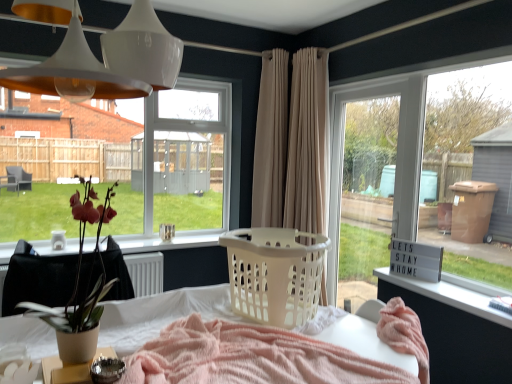
What is the approximate width of beige fabric curtain at center, which is counted as the first curtain, starting from the right?

The width of beige fabric curtain at center, which is counted as the first curtain, starting from the right, is 16.81 inches.

The height and width of the screenshot is (384, 512). Identify the location of matte brown pot at left. (85, 283).

Locate an element on the screen. The height and width of the screenshot is (384, 512). white plastic door at center is located at coordinates (396, 158).

Describe the element at coordinates (455, 329) in the screenshot. The height and width of the screenshot is (384, 512). I see `white plastic changing table at lower right` at that location.

Identify the location of beige fabric curtain at center, which is counted as the first curtain, starting from the right. (292, 143).

What's the angular difference between matte brown pot at left and beige fabric curtain at center, placed as the 1th curtain when sorted from left to right,'s facing directions?

The angle between the facing direction of matte brown pot at left and the facing direction of beige fabric curtain at center, placed as the 1th curtain when sorted from left to right, is 0.08 degrees.

Considering the sizes of matte brown pot at left and beige fabric curtain at center, the 2th curtain when ordered from right to left, in the image, is matte brown pot at left wider or thinner than beige fabric curtain at center, the 2th curtain when ordered from right to left,?

Clearly, matte brown pot at left has less width compared to beige fabric curtain at center, the 2th curtain when ordered from right to left.

Based on their sizes in the image, would you say matte brown pot at left is bigger or smaller than beige fabric curtain at center, the 2th curtain when ordered from right to left?

matte brown pot at left is smaller than beige fabric curtain at center, the 2th curtain when ordered from right to left.

Is matte brown pot at left further to camera compared to beige fabric curtain at center, placed as the 1th curtain when sorted from left to right?

That is False.

Image resolution: width=512 pixels, height=384 pixels. Identify the location of curtain below the clear glass window at upper left (from the image's perspective). (292, 143).

Does beige fabric curtain at center, the 2th curtain from the left, turn towards clear glass window at upper left?

No, beige fabric curtain at center, the 2th curtain from the left, is not facing towards clear glass window at upper left.

Which object is wider, beige fabric curtain at center, which is counted as the first curtain, starting from the right, or clear glass window at upper left?

With larger width is beige fabric curtain at center, which is counted as the first curtain, starting from the right.

Do you think beige fabric curtain at center, the 2th curtain from the left, is within clear glass window at upper left, or outside of it?

beige fabric curtain at center, the 2th curtain from the left, is spatially situated outside clear glass window at upper left.

Considering the relative sizes of beige fabric curtain at center, which is counted as the first curtain, starting from the right, and white plastic table at lower center in the image provided, is beige fabric curtain at center, which is counted as the first curtain, starting from the right, bigger than white plastic table at lower center?

No, beige fabric curtain at center, which is counted as the first curtain, starting from the right, is not bigger than white plastic table at lower center.

Consider the image. From a real-world perspective, which object rests below the other?

white plastic table at lower center is physically lower.

How much distance is there between beige fabric curtain at center, the 2th curtain from the left, and white plastic table at lower center?

A distance of 1.47 meters exists between beige fabric curtain at center, the 2th curtain from the left, and white plastic table at lower center.

Looking at this image, from the image's perspective, is beige fabric curtain at center, which is counted as the first curtain, starting from the right, located above or below white plastic table at lower center?

Based on their image positions, beige fabric curtain at center, which is counted as the first curtain, starting from the right, is located above white plastic table at lower center.

Based on the photo, visually, is white plastic door at center positioned to the left or to the right of white plastic laundry basket at center?

white plastic door at center is positioned on white plastic laundry basket at center's right side.

From the image's perspective, between white plastic door at center and white plastic laundry basket at center, which one is located above?

white plastic door at center, from the image's perspective.

In the scene shown: Could you tell me if white plastic door at center is facing white plastic laundry basket at center?

→ No, white plastic door at center is not oriented towards white plastic laundry basket at center.

The image size is (512, 384). Identify the location of window frame above the white plastic laundry basket at center (from a real-world perspective). (396, 158).

At what (x,y) coordinates should I click in order to perform the action: click on window beneath the beige fabric curtain at center, placed as the 1th curtain when sorted from left to right (from a real-world perspective). Please return your answer as a coordinate pair (x, y). Looking at the image, I should click on (143, 161).

Is clear glass window at upper left inside beige fabric curtain at center, the 2th curtain when ordered from right to left?

No.

Is beige fabric curtain at center, placed as the 1th curtain when sorted from left to right, far from clear glass window at upper left?

Indeed, beige fabric curtain at center, placed as the 1th curtain when sorted from left to right, is not near clear glass window at upper left.

Is beige fabric curtain at center, the 2th curtain when ordered from right to left, at the right side of clear glass window at upper left?

Yes.

Consider the image. From a real-world perspective, is white plastic table at lower center positioned under beige fabric curtain at center, the 2th curtain from the left, based on gravity?

Indeed, from a real-world perspective, white plastic table at lower center is positioned beneath beige fabric curtain at center, the 2th curtain from the left.

Considering the sizes of objects white plastic table at lower center and beige fabric curtain at center, which is counted as the first curtain, starting from the right, in the image provided, who is thinner, white plastic table at lower center or beige fabric curtain at center, which is counted as the first curtain, starting from the right,?

beige fabric curtain at center, which is counted as the first curtain, starting from the right.

Considering the relative sizes of white plastic table at lower center and beige fabric curtain at center, the 2th curtain from the left, in the image provided, is white plastic table at lower center bigger than beige fabric curtain at center, the 2th curtain from the left,?

Yes, white plastic table at lower center is bigger than beige fabric curtain at center, the 2th curtain from the left.

Does white plastic table at lower center appear on the left side of beige fabric curtain at center, the 2th curtain from the left?

Indeed, white plastic table at lower center is positioned on the left side of beige fabric curtain at center, the 2th curtain from the left.

Is point (329, 285) more distant than point (278, 219)?

No.

Are white plastic door at center and beige fabric curtain at center, placed as the 1th curtain when sorted from left to right, far apart?

No, white plastic door at center is not far from beige fabric curtain at center, placed as the 1th curtain when sorted from left to right.

From a real-world perspective, which object rests below the other?

From a 3D spatial view, white plastic door at center is below.

From the image's perspective, is white plastic door at center located above or below beige fabric curtain at center, placed as the 1th curtain when sorted from left to right?

white plastic door at center is below beige fabric curtain at center, placed as the 1th curtain when sorted from left to right.

The image size is (512, 384). Find the location of `curtain that is the 2nd object located behind the matte brown pot at left`. curtain that is the 2nd object located behind the matte brown pot at left is located at coordinates (270, 141).

Find the location of `window in front of the beige fabric curtain at center, the 2th curtain from the left`. window in front of the beige fabric curtain at center, the 2th curtain from the left is located at coordinates (143, 161).

Considering their positions, is white glossy pendant lights at upper center positioned further to beige fabric curtain at center, which is counted as the first curtain, starting from the right, than clear glass window at upper left?

Among the two, clear glass window at upper left is located further to beige fabric curtain at center, which is counted as the first curtain, starting from the right.

Considering their positions, is white plastic changing table at lower right positioned further to white plastic laundry basket at center than beige fabric curtain at center, the 2th curtain when ordered from right to left?

Based on the image, beige fabric curtain at center, the 2th curtain when ordered from right to left, appears to be further to white plastic laundry basket at center.

Based on their spatial positions, is white plastic door at center or white glossy pendant lights at upper center closer to clear glass window at upper left?

white plastic door at center is closer to clear glass window at upper left.

From the image, which object appears to be nearer to matte brown pot at left, beige fabric curtain at center, placed as the 1th curtain when sorted from left to right, or white plastic laundry basket at center?

white plastic laundry basket at center.

Looking at the image, which one is located closer to beige fabric curtain at center, placed as the 1th curtain when sorted from left to right, beige fabric curtain at center, the 2th curtain from the left, or white glossy pendant lights at upper center?

beige fabric curtain at center, the 2th curtain from the left.

Based on their spatial positions, is white plastic table at lower center or beige fabric curtain at center, which is counted as the first curtain, starting from the right, further from white plastic laundry basket at center?

Based on the image, beige fabric curtain at center, which is counted as the first curtain, starting from the right, appears to be further to white plastic laundry basket at center.

Based on their spatial positions, is beige fabric curtain at center, which is counted as the first curtain, starting from the right, or white plastic laundry basket at center closer to matte brown pot at left?

Based on the image, white plastic laundry basket at center appears to be nearer to matte brown pot at left.

Estimate the real-world distances between objects in this image. Which object is further from white plastic laundry basket at center, white plastic table at lower center or matte brown pot at left?

matte brown pot at left is positioned further to the anchor white plastic laundry basket at center.

Identify the location of basket positioned between white plastic table at lower center and white plastic changing table at lower right from near to far. (275, 274).

What are the coordinates of `houseplant between white glossy pendant lights at upper center and white plastic table at lower center in the vertical direction` in the screenshot? It's located at (85, 283).

This screenshot has width=512, height=384. Find the location of `basket positioned between white glossy pendant lights at upper center and beige fabric curtain at center, the 2th curtain from the left, from near to far`. basket positioned between white glossy pendant lights at upper center and beige fabric curtain at center, the 2th curtain from the left, from near to far is located at coordinates (275, 274).

Find the location of a particular element. changing table located between white plastic laundry basket at center and beige fabric curtain at center, the 2th curtain when ordered from right to left, in the depth direction is located at coordinates (455, 329).